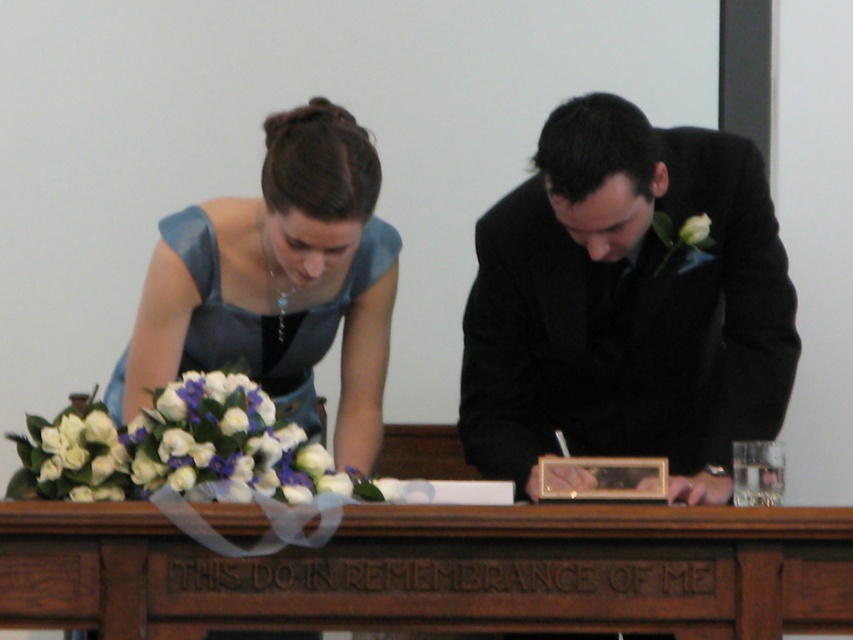
Which is more to the right, white matte flowers at center or white matte flower at right?

white matte flower at right

Is white matte flowers at center above white matte flower at right?

Actually, white matte flowers at center is below white matte flower at right.

Locate an element on the screen. Image resolution: width=853 pixels, height=640 pixels. white matte flowers at center is located at coordinates (177, 448).

Does matte blue dress at center have a larger size compared to brown wooden table at center?

Correct, matte blue dress at center is larger in size than brown wooden table at center.

Describe the element at coordinates (627, 305) in the screenshot. Image resolution: width=853 pixels, height=640 pixels. I see `matte blue dress at center` at that location.

Who is more distant from viewer, (x=659, y=436) or (x=50, y=550)?

Point (x=659, y=436)

The width and height of the screenshot is (853, 640). I want to click on matte blue dress at center, so click(x=627, y=305).

Is point (253, 268) behind point (44, 476)?

That is True.

Which is in front, point (264, 337) or point (258, 428)?

Point (258, 428) is more forward.

You are a GUI agent. You are given a task and a screenshot of the screen. Output one action in this format:
    pyautogui.click(x=<x>, y=<y>)
    Task: Click on the teal satin dress at upper left
    The height and width of the screenshot is (640, 853).
    Given the screenshot: What is the action you would take?
    pyautogui.click(x=277, y=282)

What are the coordinates of `teal satin dress at upper left` in the screenshot? It's located at (277, 282).